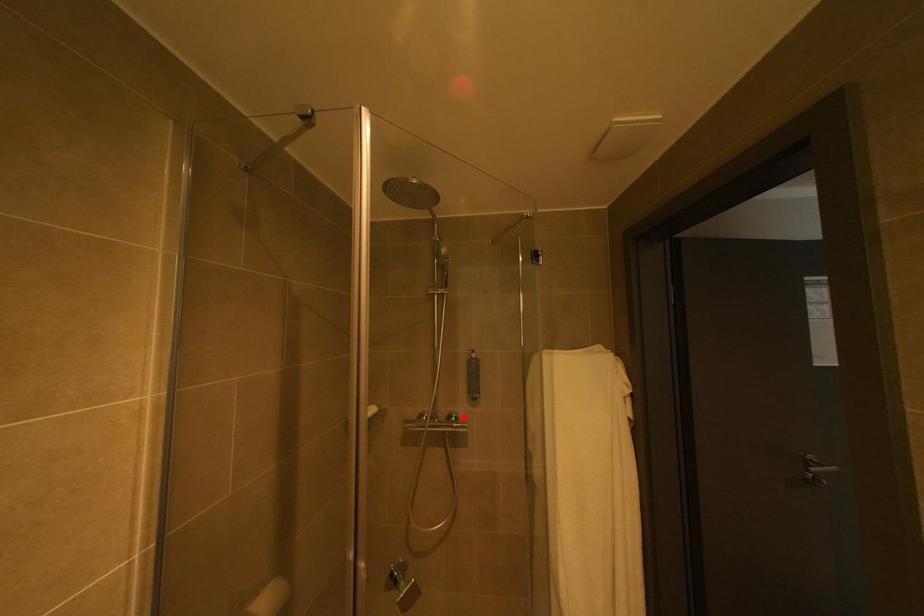
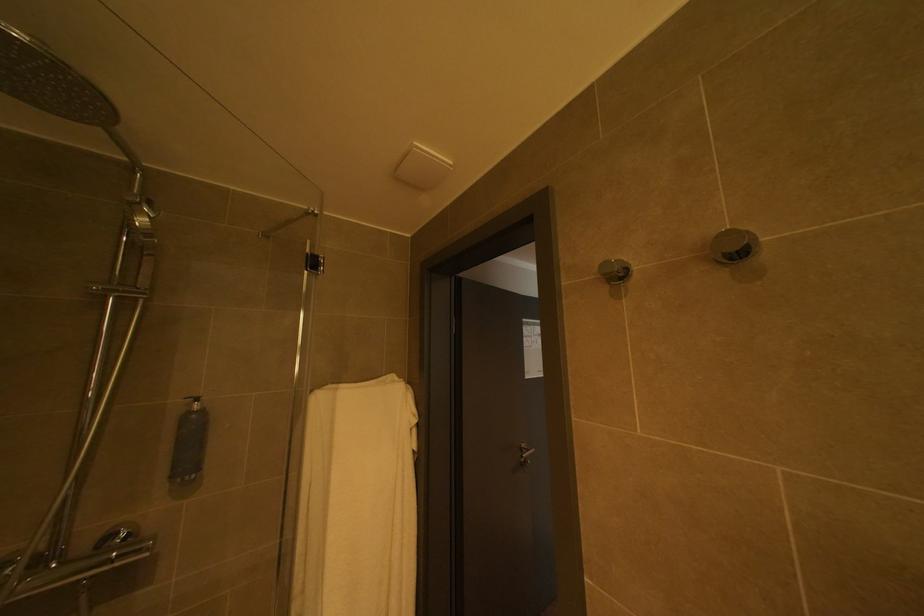
Question: I am providing you with two images of the same scene from different viewpoints. Image1 has a red point marked. In image2, the corresponding 3D location appears at what relative position? Reply with the corresponding letter.

Choices:
 (A) Closer
 (B) Farther

Answer: (A)